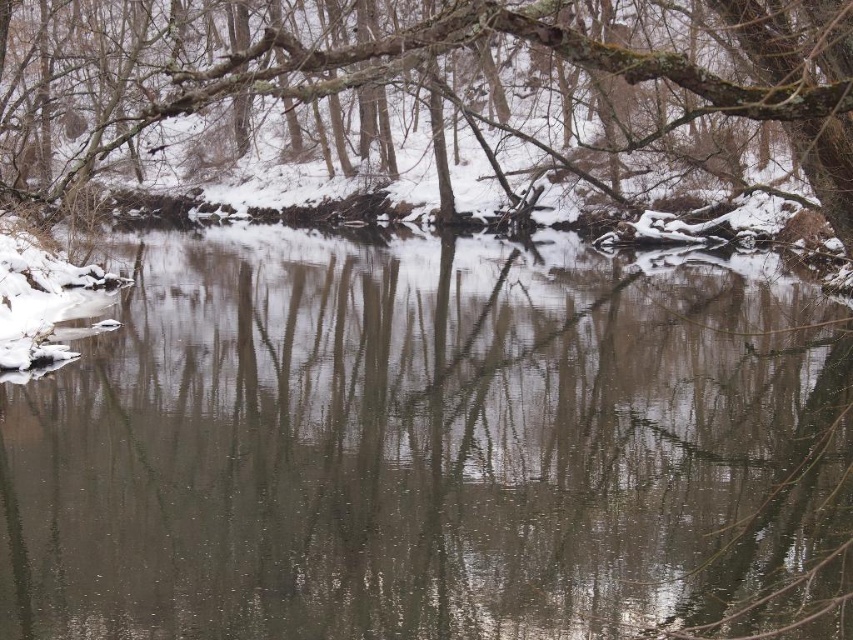
Question: Among these objects, which one is nearest to the camera?

Choices:
 (A) smooth bark tree at upper center
 (B) clear water at center

Answer: (A)

Question: Does clear water at center appear on the right side of smooth bark tree at upper center?

Choices:
 (A) no
 (B) yes

Answer: (B)

Question: Does clear water at center have a larger size compared to smooth bark tree at upper center?

Choices:
 (A) no
 (B) yes

Answer: (A)

Question: Which of the following is the closest to the observer?

Choices:
 (A) smooth bark tree at upper center
 (B) clear water at center

Answer: (A)

Question: Can you confirm if clear water at center is positioned above smooth bark tree at upper center?

Choices:
 (A) no
 (B) yes

Answer: (A)